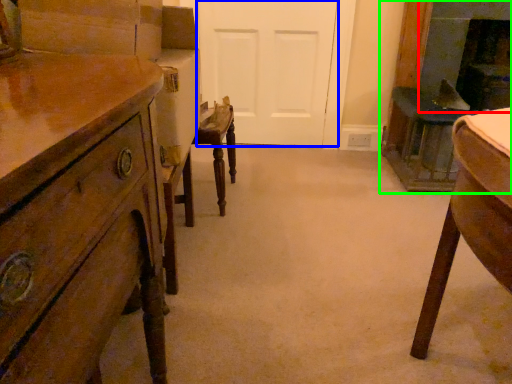
Question: Based on their relative distances, which object is farther from fireplace (highlighted by a red box)? Choose from door (highlighted by a blue box) and fireplace (highlighted by a green box).

Choices:
 (A) door
 (B) fireplace

Answer: (A)